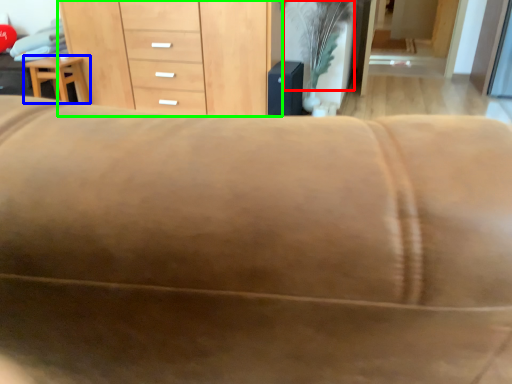
Question: Based on their relative distances, which object is farther from plant (highlighted by a red box)? Choose from furniture (highlighted by a blue box) and chest of drawers (highlighted by a green box).

Choices:
 (A) furniture
 (B) chest of drawers

Answer: (A)